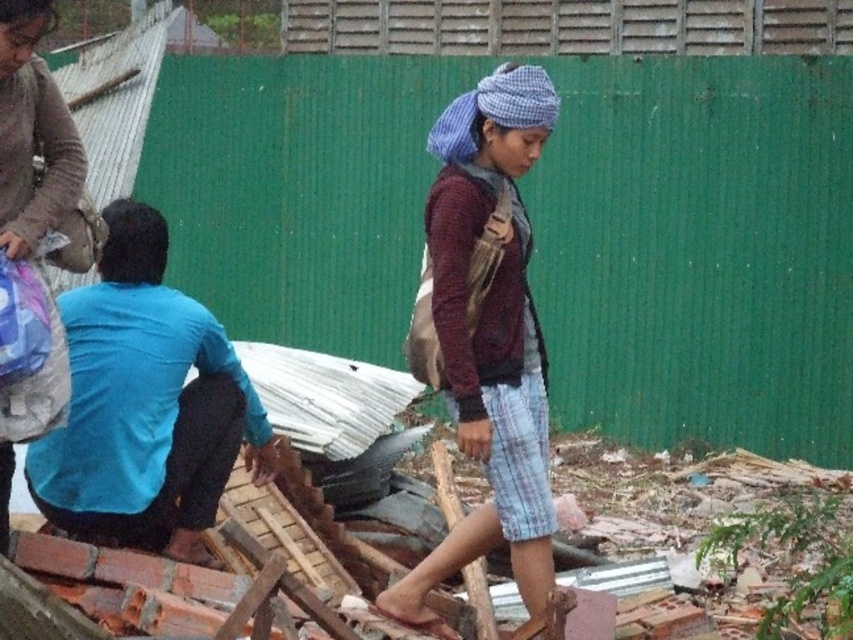
You are a delivery person who needs to place a package between the maroon knitted sweater at center and the matte gray sweater at upper left. Can you fit the package in the space between them if the package requires 4.5 feet of space?

The distance between the maroon knitted sweater at center and the matte gray sweater at upper left is 5.04 feet, which is greater than the required 4.5 feet. Therefore, the package can be placed between them.

You are standing at the point with coordinates point (38, 97) and want to move towards the point with coordinates point (521, 208). Based on the scene description, will you be moving towards the camera or away from it?

Since point (521, 208) is further to the camera than point (38, 97), moving from point (38, 97) to point (521, 208) means you are moving towards the camera.